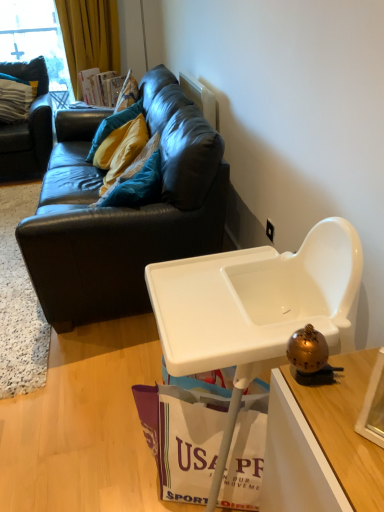
Question: From the image's perspective, is gold metallic bell at right positioned above or below teal fabric pillow at upper left, arranged as the second pillow when viewed from the top?

Choices:
 (A) above
 (B) below

Answer: (B)

Question: Considering the positions of gold metallic bell at right and teal fabric pillow at upper left, which appears as the first pillow when ordered from the bottom, in the image, is gold metallic bell at right taller or shorter than teal fabric pillow at upper left, which appears as the first pillow when ordered from the bottom,?

Choices:
 (A) short
 (B) tall

Answer: (A)

Question: Estimate the real-world distances between objects in this image. Which object is farther from the teal fabric pillow at upper left, marked as the first pillow in a right-to-left arrangement?

Choices:
 (A) black leather couch at upper left, the first studio couch positioned from the right
 (B) white plastic power outlet at upper right
 (C) white paper shopping bag at lower center
 (D) gold metallic bell at right
 (E) white plastic highchair at lower right

Answer: (D)

Question: Which object is the closest to the white plastic power outlet at upper right?

Choices:
 (A) white plastic highchair at lower right
 (B) gold metallic bell at right
 (C) teal fabric pillow at upper left, the 1th pillow positioned from the back
 (D) teal fabric pillow at upper left, arranged as the second pillow when viewed from the top
 (E) black leather couch at upper left, the first studio couch positioned from the right

Answer: (D)